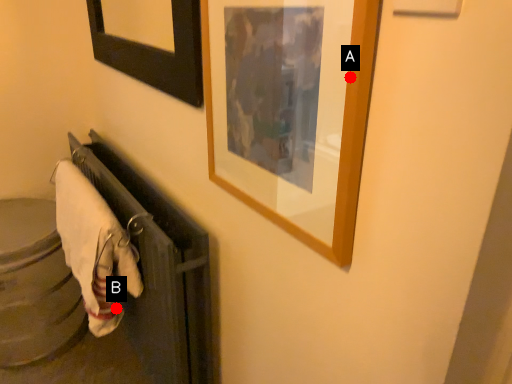
Question: Two points are circled on the image, labeled by A and B beside each circle. Among these points, which one is farthest from the camera?

Choices:
 (A) A is further
 (B) B is further

Answer: (B)